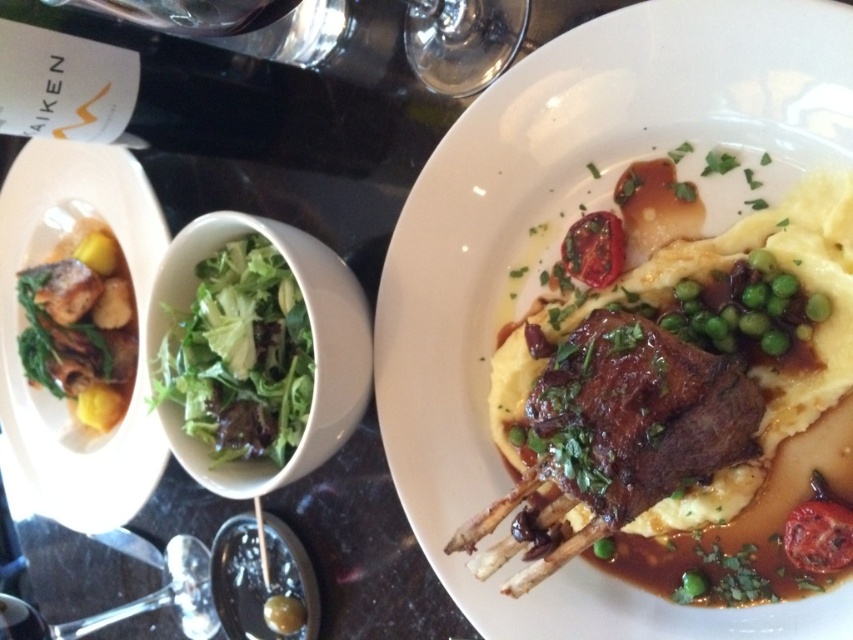
Is brown glazed lamb chop at center bigger than matte white plate at left?

Indeed, brown glazed lamb chop at center has a larger size compared to matte white plate at left.

Can you confirm if brown glazed lamb chop at center is positioned above matte white plate at left?

Incorrect, brown glazed lamb chop at center is not positioned above matte white plate at left.

Between point (514, 237) and point (25, 152), which one is positioned in front?

Point (514, 237)

Image resolution: width=853 pixels, height=640 pixels. Identify the location of brown glazed lamb chop at center. (573, 220).

Can you confirm if transparent glass at upper center is positioned below slightly charred tomato at upper center?

No.

Who is more distant from viewer, (x=482, y=52) or (x=606, y=225)?

The point (x=482, y=52) is more distant.

Is point (479, 80) behind point (614, 218)?

Yes, point (479, 80) is behind point (614, 218).

You are a GUI agent. You are given a task and a screenshot of the screen. Output one action in this format:
    pyautogui.click(x=<x>, y=<y>)
    Task: Click on the transparent glass at upper center
    The width and height of the screenshot is (853, 640).
    Given the screenshot: What is the action you would take?
    pyautogui.click(x=462, y=42)

Who is positioned more to the left, brown glazed lamb chop at center or green leafymaterial/texturevegetable at center?

Positioned to the left is green leafymaterial/texturevegetable at center.

Measure the distance between brown glazed lamb chop at center and green leafymaterial/texturevegetable at center.

They are 8.57 inches apart.

Between point (418, 497) and point (212, 392), which one is positioned behind?

The point (418, 497) is behind.

Image resolution: width=853 pixels, height=640 pixels. What are the coordinates of `brown glazed lamb chop at center` in the screenshot? It's located at (573, 220).